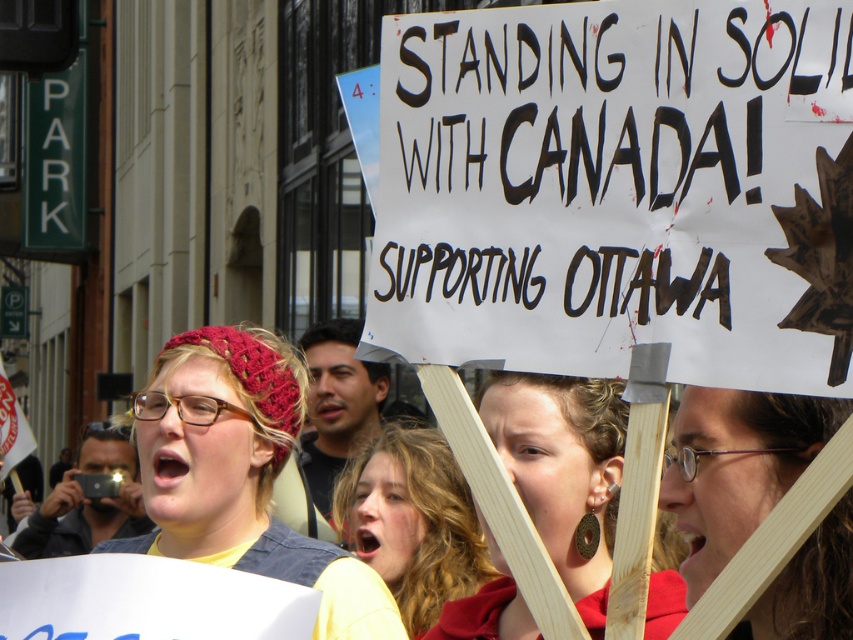
Question: Does knitted red beanie at center come behind wooden sign at center?

Choices:
 (A) no
 (B) yes

Answer: (B)

Question: Is knitted red beanie at center below curly hair at center?

Choices:
 (A) no
 (B) yes

Answer: (A)

Question: Which object appears farthest from the camera in this image?

Choices:
 (A) curly hair at center
 (B) matte wooden sign at center

Answer: (A)

Question: Is knitted red beanie at center positioned before curly hair at center?

Choices:
 (A) no
 (B) yes

Answer: (A)

Question: Which point appears closest to the camera in this image?

Choices:
 (A) (247, 552)
 (B) (840, 572)

Answer: (B)

Question: Which object is positioned farthest from the matte wooden sign at center?

Choices:
 (A) wooden sign at center
 (B) curly hair at center

Answer: (B)